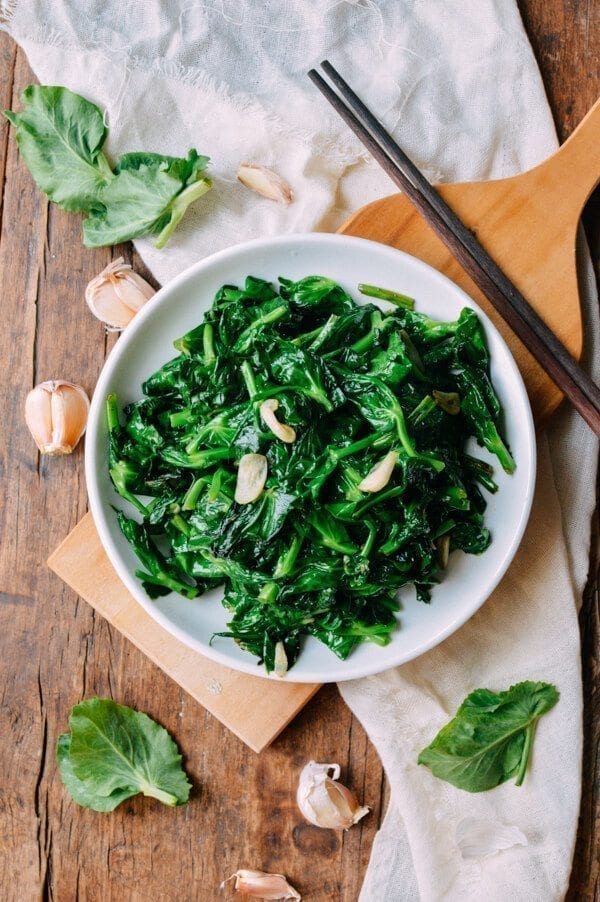
Find the location of a particular element. The image size is (600, 902). bowl is located at coordinates (336, 670), (151, 329), (386, 268), (512, 529).